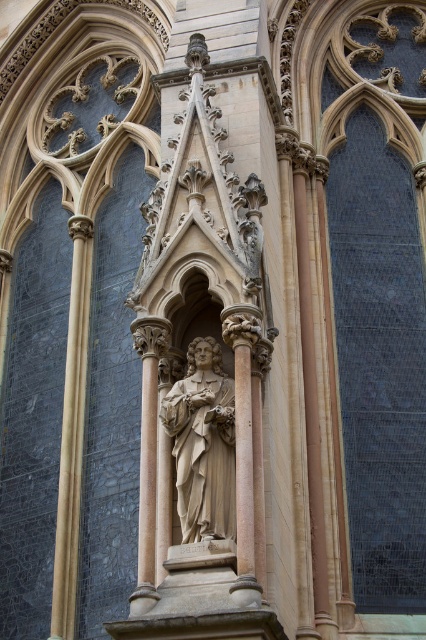
Question: Can you confirm if polished stone column at left is positioned to the left of beige stone column at center?

Choices:
 (A) no
 (B) yes

Answer: (B)

Question: Observing the image, what is the correct spatial positioning of polished stone statue at center in reference to beige stone column at center?

Choices:
 (A) right
 (B) left

Answer: (A)

Question: Is polished stone statue at center below polished stone column at left?

Choices:
 (A) no
 (B) yes

Answer: (A)

Question: Estimate the real-world distances between objects in this image. Which object is closer to the polished stone column at left?

Choices:
 (A) beige stone column at center
 (B) polished stone statue at center

Answer: (A)

Question: Among these objects, which one is nearest to the camera?

Choices:
 (A) polished stone statue at center
 (B) beige stone column at center
 (C) polished stone column at left

Answer: (B)

Question: Which of these objects is positioned closest to the polished stone statue at center?

Choices:
 (A) beige stone column at center
 (B) polished stone column at left

Answer: (A)